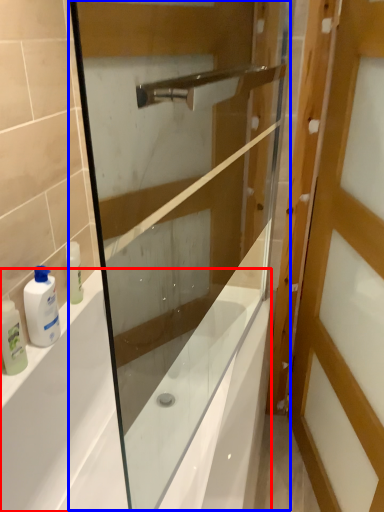
Question: Which of the following is the farthest to the observer, bath (highlighted by a red box) or screen door (highlighted by a blue box)?

Choices:
 (A) bath
 (B) screen door

Answer: (A)